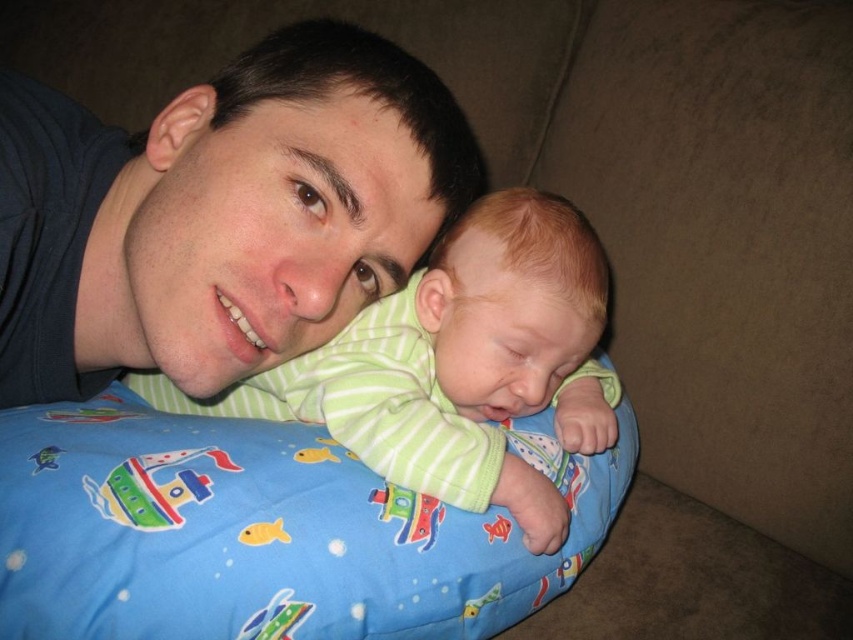
Looking at this image, you are a photographer trying to capture the perfect shot of the adult and baby. You notice the matte blue shirt at upper left and the green striped shirt at center. Which shirt should you focus on if you want to highlight the one that is taller in the frame?

The matte blue shirt at upper left is taller than the green striped shirt at center, so focusing on the matte blue shirt at upper left will highlight the taller one.

From the picture: You are a parent holding a baby and want to place them on the blue fabric bean bag at center. Considering the distance between you and the bean bag, can you safely hand the baby to the bean bag without needing to step closer?

The blue fabric bean bag at center is 17.50 inches away from the viewer. Since this distance is within a comfortable reach for handing over a baby, you can safely place the baby on the bean bag without needing to step closer.